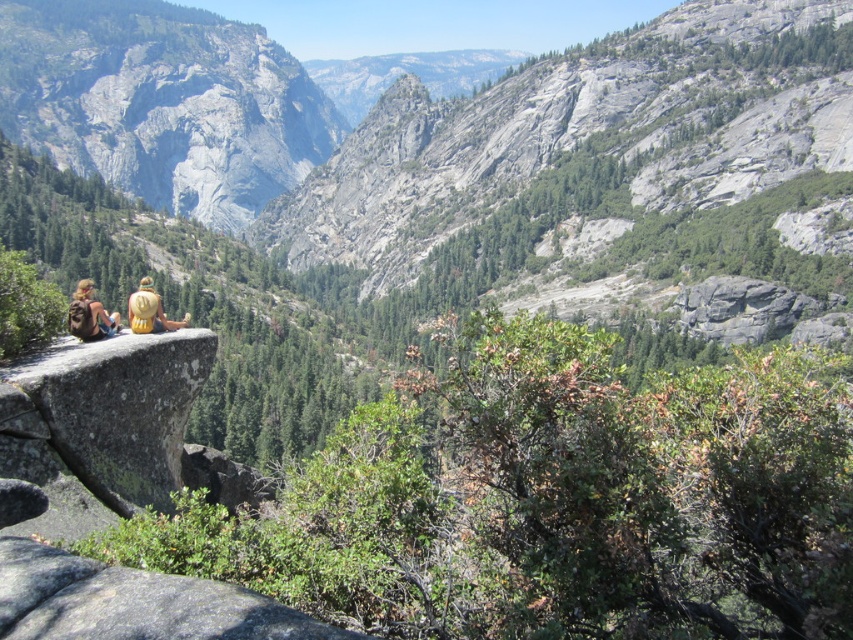
You are a photographer planning to capture a wide landscape shot. You notice the brown backpack at left and the golden straw hat at center in your frame. To ensure both items are fully visible without any overlap, which object should you adjust your camera angle to prioritize keeping in the frame?

The brown backpack at left might be wider than golden straw hat at center, so you should prioritize keeping the brown backpack at left in the frame since it requires more space to avoid overlap.

You are a hiker who wants to place your golden straw hat at center on the ground next to your brown backpack at left. Given that your backpack is 1.5 feet wide, is there enough space between them to place the hat without it overlapping the backpack?

The distance between the brown backpack at left and golden straw hat at center is 11.35 feet, which is significantly larger than the backpack width of 1.5 feet. Therefore, there is ample space to place the hat next to the backpack without overlapping.

You are standing at the point with coordinates point (149,284) and want to move towards the point with coordinates point (96,323). Based on the scene description, will you be moving towards or away from the rocky outcrop where the hikers are sitting?

Point (96,323) is in front of point (149,284), so moving towards point (96,323) means you are moving towards the rocky outcrop where the hikers are sitting.